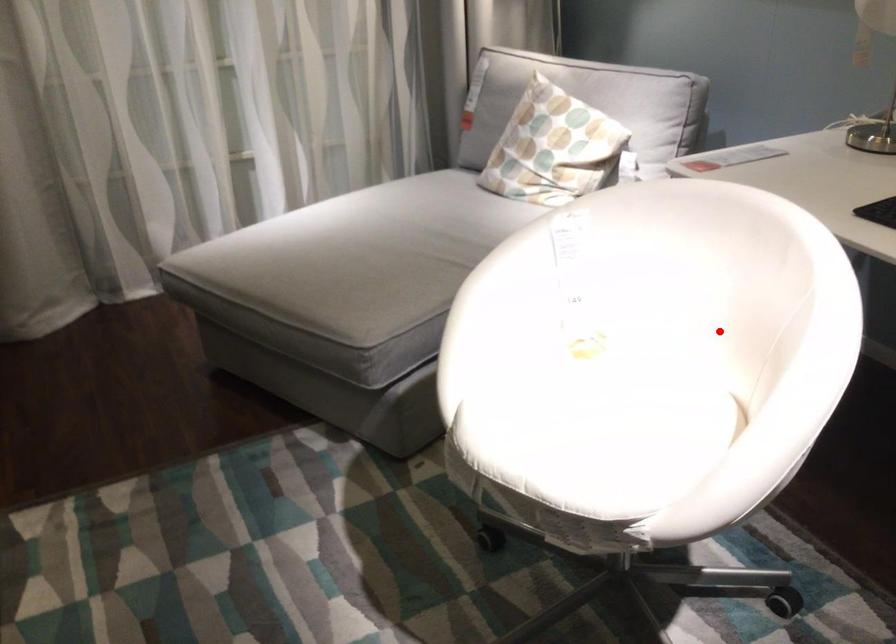
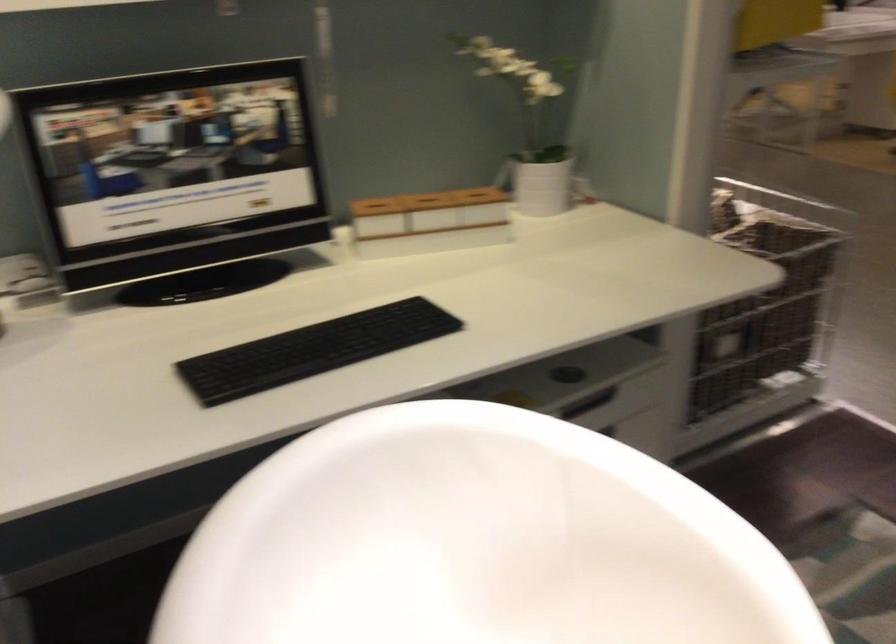
Locate, in the second image, the point that corresponds to the highlighted location in the first image.

(460, 614)